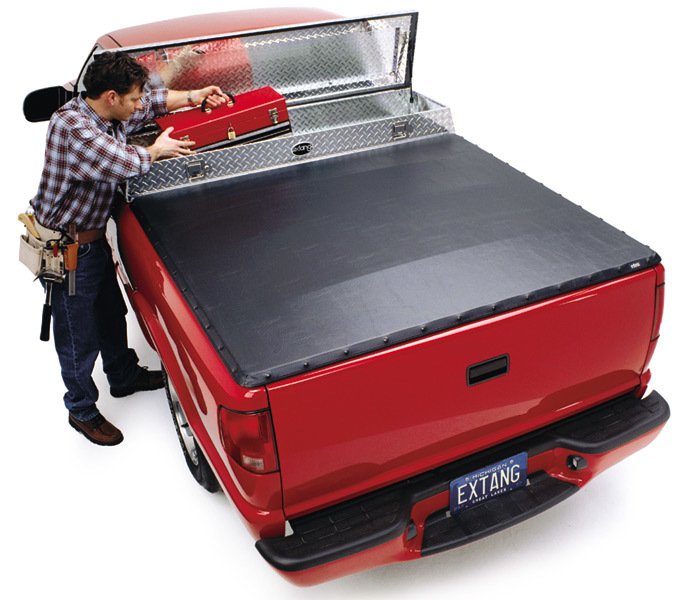
In order to click on handles in this screenshot , I will do `click(204, 104)`, `click(491, 371)`.